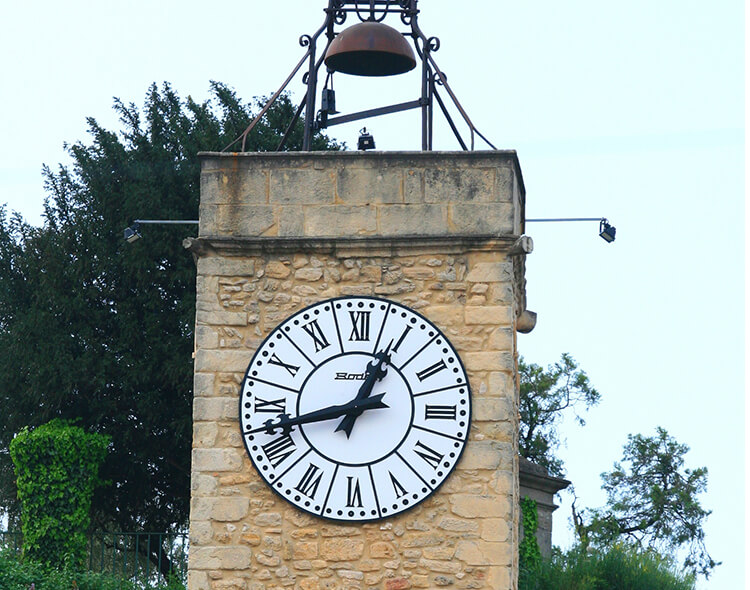
Locate an element on the screen. This screenshot has width=750, height=590. brick wall is located at coordinates (541, 490).